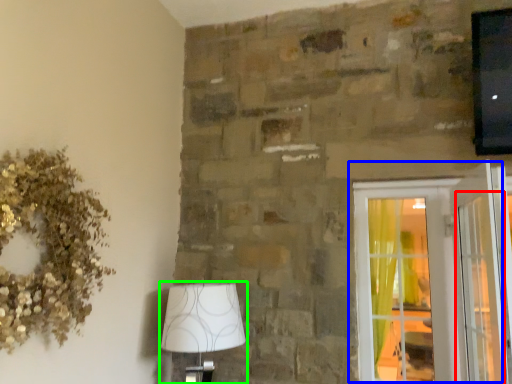
Question: Which object is positioned closest to screen door (highlighted by a red box)? Select from window (highlighted by a blue box) and lamp (highlighted by a green box).

Choices:
 (A) window
 (B) lamp

Answer: (A)